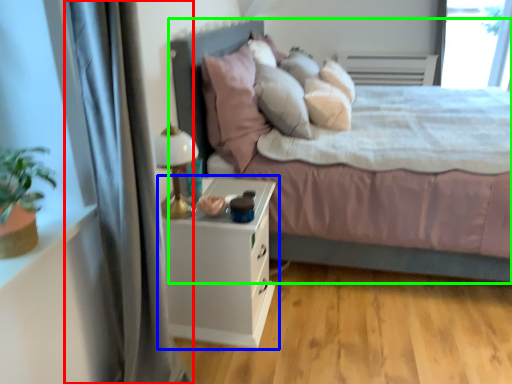
Question: Which object is the farthest from curtain (highlighted by a red box)? Choose among these: nightstand (highlighted by a blue box) or bed (highlighted by a green box).

Choices:
 (A) nightstand
 (B) bed

Answer: (B)